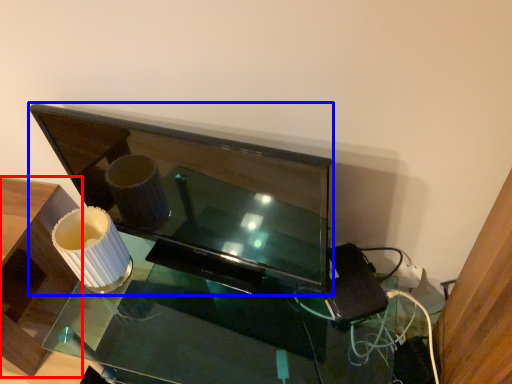
Question: Which of the following is the closest to the observer, furniture (highlighted by a red box) or television (highlighted by a blue box)?

Choices:
 (A) furniture
 (B) television

Answer: (B)